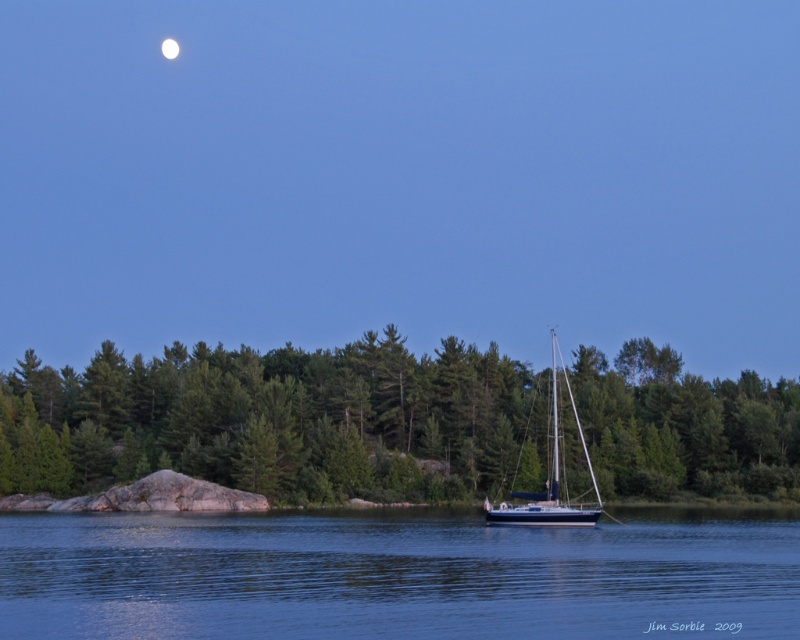
Does green matte tree at lower left appear on the left side of bright white sphere at upper center?

No, green matte tree at lower left is not to the left of bright white sphere at upper center.

Which is below, green matte tree at lower left or bright white sphere at upper center?

green matte tree at lower left

This screenshot has width=800, height=640. Identify the location of green matte tree at lower left. (280, 420).

Between blue water at center and blue glossy sailboat at center, which one has less height?

blue water at center is shorter.

Which is more to the left, blue water at center or blue glossy sailboat at center?

blue water at center

What do you see at coordinates (396, 577) in the screenshot? I see `blue water at center` at bounding box center [396, 577].

Identify the location of blue water at center. (396, 577).

Which is more to the right, blue glossy sailboat at center or bright white sphere at upper center?

From the viewer's perspective, blue glossy sailboat at center appears more on the right side.

In the scene shown: Does blue glossy sailboat at center lie in front of bright white sphere at upper center?

Yes, it is in front of bright white sphere at upper center.

I want to click on blue glossy sailboat at center, so click(552, 477).